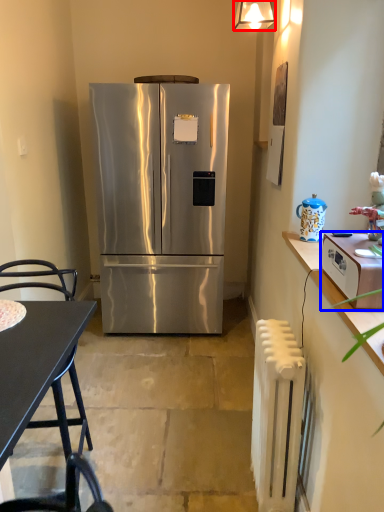
Question: Among these objects, which one is nearest to the camera, lamp (highlighted by a red box) or toaster (highlighted by a blue box)?

Choices:
 (A) lamp
 (B) toaster

Answer: (B)